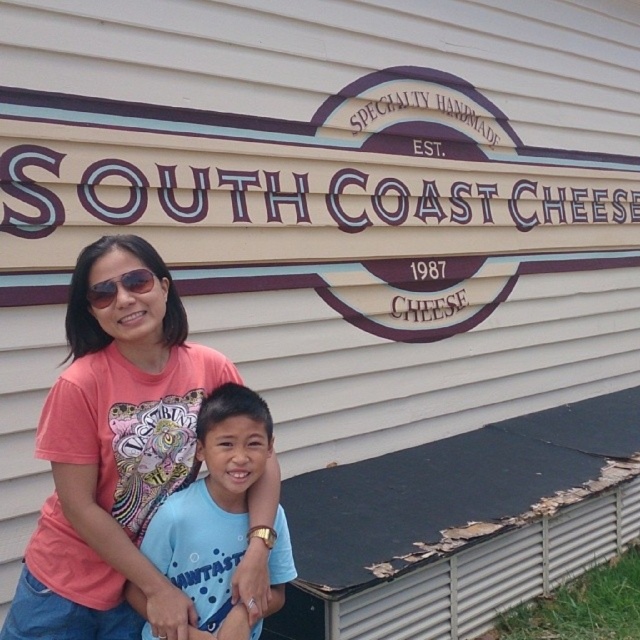
Is pink fabric shirt at center smaller than black plastic sunglasses at upper center?

Actually, pink fabric shirt at center might be larger than black plastic sunglasses at upper center.

At what (x,y) coordinates should I click in order to perform the action: click on pink fabric shirt at center. Please return your answer as a coordinate pair (x, y). Looking at the image, I should click on (113, 454).

At what (x,y) coordinates should I click in order to perform the action: click on pink fabric shirt at center. Please return your answer as a coordinate pair (x, y). The height and width of the screenshot is (640, 640). Looking at the image, I should click on (113, 454).

I want to click on pink fabric shirt at center, so click(x=113, y=454).

Looking at this image, which of these two, blue cotton shirt at center or black plastic sunglasses at upper center, stands taller?

Standing taller between the two is blue cotton shirt at center.

This screenshot has width=640, height=640. Describe the element at coordinates (212, 506) in the screenshot. I see `blue cotton shirt at center` at that location.

The image size is (640, 640). In order to click on blue cotton shirt at center in this screenshot , I will do coord(212,506).

Is pink fabric shirt at center smaller than blue cotton shirt at center?

No.

At what (x,y) coordinates should I click in order to perform the action: click on pink fabric shirt at center. Please return your answer as a coordinate pair (x, y). The image size is (640, 640). Looking at the image, I should click on (113, 454).

Is point (113, 396) behind point (211, 634)?

No.

Where is `pink fabric shirt at center`? pink fabric shirt at center is located at coordinates (113, 454).